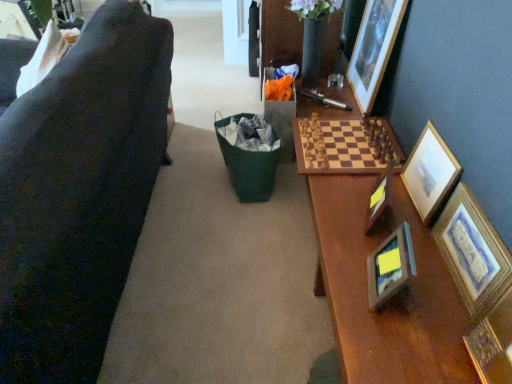
Question: Considering the positions of point (355, 59) and point (11, 8), is point (355, 59) closer or farther from the camera than point (11, 8)?

Choices:
 (A) closer
 (B) farther

Answer: (B)

Question: Is wooden picture frame at upper right, which ranks as the third picture frame in right-to-left order, taller or shorter than wooden picture frame at upper left, the first picture frame when ordered from left to right?

Choices:
 (A) short
 (B) tall

Answer: (B)

Question: Which object is positioned closest to the wooden picture frame at right, acting as the 3th picture frame starting from the left?

Choices:
 (A) wooden picture frame at upper right, which ranks as the third picture frame in right-to-left order
 (B) wooden chessboard at center
 (C) wooden framed print at right, the sixth picture frame from the left
 (D) wooden picture frame at upper left, acting as the 6th picture frame starting from the right
 (E) wooden photo frame at center, which is the 2th picture frame from left to right

Answer: (E)

Question: Estimate the real-world distances between objects in this image. Which object is farther from the wooden chessboard at center?

Choices:
 (A) wooden framed print at right, the sixth picture frame from the left
 (B) wooden photo frame at center, which is the 2th picture frame from left to right
 (C) wooden picture frame at upper right, the fourth picture frame viewed from the left
 (D) wooden picture frame at right, acting as the 3th picture frame starting from the left
 (E) gold-framed picture at right, the 2th picture frame viewed from the right

Answer: (A)